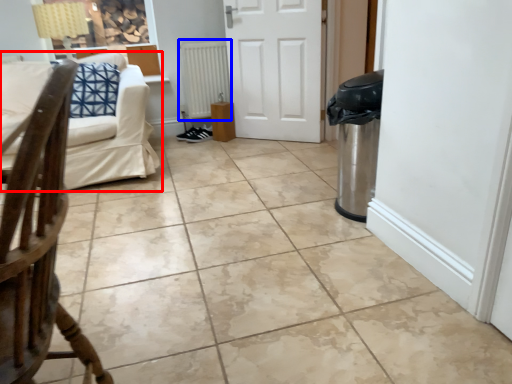
Question: Which object is closer to the camera taking this photo, studio couch (highlighted by a red box) or radiator (highlighted by a blue box)?

Choices:
 (A) studio couch
 (B) radiator

Answer: (A)